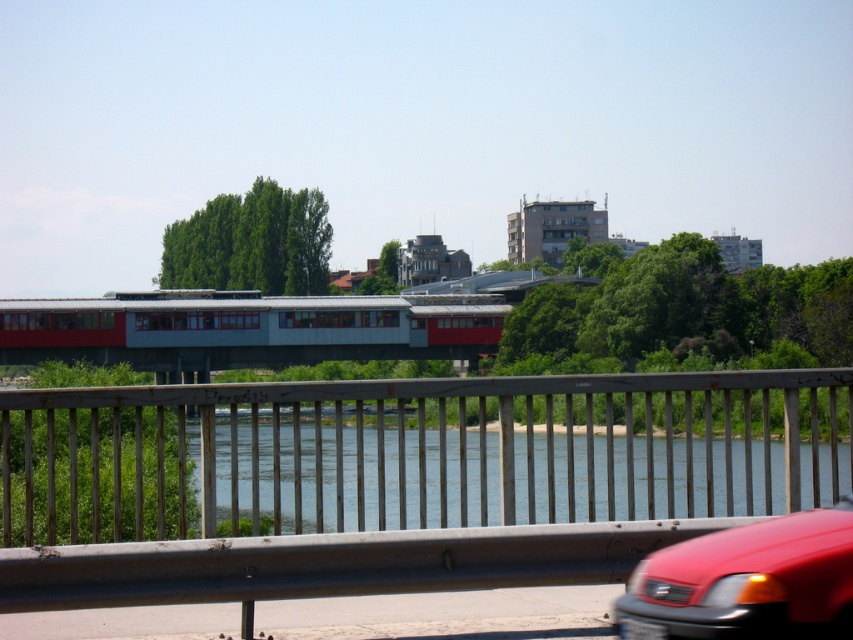
Question: Which point appears closest to the camera in this image?

Choices:
 (A) (175, 602)
 (B) (264, 496)

Answer: (A)

Question: Is blue water at center further to camera compared to glossy red car at lower right?

Choices:
 (A) no
 (B) yes

Answer: (B)

Question: Which object is farther from the camera taking this photo?

Choices:
 (A) glossy red car at lower right
 (B) blue water at center

Answer: (B)

Question: Considering the relative positions of blue water at center and glossy red car at lower right in the image provided, where is blue water at center located with respect to glossy red car at lower right?

Choices:
 (A) right
 (B) left

Answer: (B)

Question: Which of the following is the farthest from the observer?

Choices:
 (A) metallic gray railing at center
 (B) blue water at center
 (C) glossy red car at lower right

Answer: (B)

Question: Does metallic gray railing at center appear over blue water at center?

Choices:
 (A) no
 (B) yes

Answer: (B)